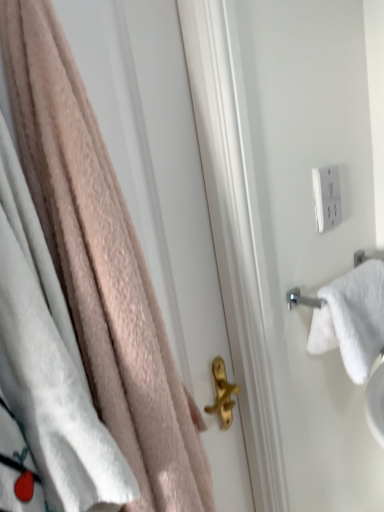
Question: Does white cotton towel at right, positioned as the 2th towel in left-to-right order, turn towards soft pink towel at left, positioned as the 1th towel in front-to-back order?

Choices:
 (A) yes
 (B) no

Answer: (B)

Question: From the image's perspective, would you say white cotton towel at right, acting as the 1th towel starting from the back, is shown under soft pink towel at left, marked as the 2th towel in a right-to-left arrangement?

Choices:
 (A) yes
 (B) no

Answer: (A)

Question: Can you confirm if white cotton towel at right, which is counted as the second towel, starting from the front, is bigger than soft pink towel at left, positioned as the 1th towel in front-to-back order?

Choices:
 (A) yes
 (B) no

Answer: (B)

Question: Considering the relative sizes of white cotton towel at right, positioned as the 2th towel in left-to-right order, and soft pink towel at left, which appears as the second towel when viewed from the back, in the image provided, is white cotton towel at right, positioned as the 2th towel in left-to-right order, shorter than soft pink towel at left, which appears as the second towel when viewed from the back,?

Choices:
 (A) no
 (B) yes

Answer: (B)

Question: Is there a large distance between white cotton towel at right, marked as the 1th towel in a right-to-left arrangement, and soft pink towel at left, which appears as the second towel when viewed from the back?

Choices:
 (A) no
 (B) yes

Answer: (A)

Question: Is white plastic outlet at upper right in front of or behind soft pink towel at left, positioned as the 1th towel in front-to-back order, in the image?

Choices:
 (A) front
 (B) behind

Answer: (B)

Question: Considering the relative positions of white plastic outlet at upper right and soft pink towel at left, which appears as the second towel when viewed from the back, in the image provided, is white plastic outlet at upper right to the left or to the right of soft pink towel at left, which appears as the second towel when viewed from the back,?

Choices:
 (A) left
 (B) right

Answer: (B)

Question: From the image's perspective, is white plastic outlet at upper right positioned above or below soft pink towel at left, which appears as the second towel when viewed from the back?

Choices:
 (A) below
 (B) above

Answer: (B)

Question: Considering the positions of white plastic outlet at upper right and soft pink towel at left, which appears as the second towel when viewed from the back, in the image, is white plastic outlet at upper right wider or thinner than soft pink towel at left, which appears as the second towel when viewed from the back,?

Choices:
 (A) thin
 (B) wide

Answer: (A)

Question: From the image's perspective, is white cotton towel at right, which is counted as the second towel, starting from the front, located above or below soft pink towel at left, which appears as the second towel when viewed from the back?

Choices:
 (A) below
 (B) above

Answer: (A)

Question: From a real-world perspective, is white cotton towel at right, acting as the 1th towel starting from the back, physically located above or below soft pink towel at left, positioned as the 1th towel in front-to-back order?

Choices:
 (A) above
 (B) below

Answer: (B)

Question: Looking at the image, does white cotton towel at right, acting as the 1th towel starting from the back, seem bigger or smaller compared to soft pink towel at left, which appears as the second towel when viewed from the back?

Choices:
 (A) small
 (B) big

Answer: (A)

Question: In terms of height, does white cotton towel at right, marked as the 1th towel in a right-to-left arrangement, look taller or shorter compared to soft pink towel at left, which appears as the second towel when viewed from the back?

Choices:
 (A) tall
 (B) short

Answer: (B)

Question: From the image's perspective, is white cotton towel at right, positioned as the 2th towel in left-to-right order, located above or below white plastic outlet at upper right?

Choices:
 (A) above
 (B) below

Answer: (B)

Question: Based on their positions, is white cotton towel at right, which is counted as the second towel, starting from the front, located to the left or right of white plastic outlet at upper right?

Choices:
 (A) right
 (B) left

Answer: (A)